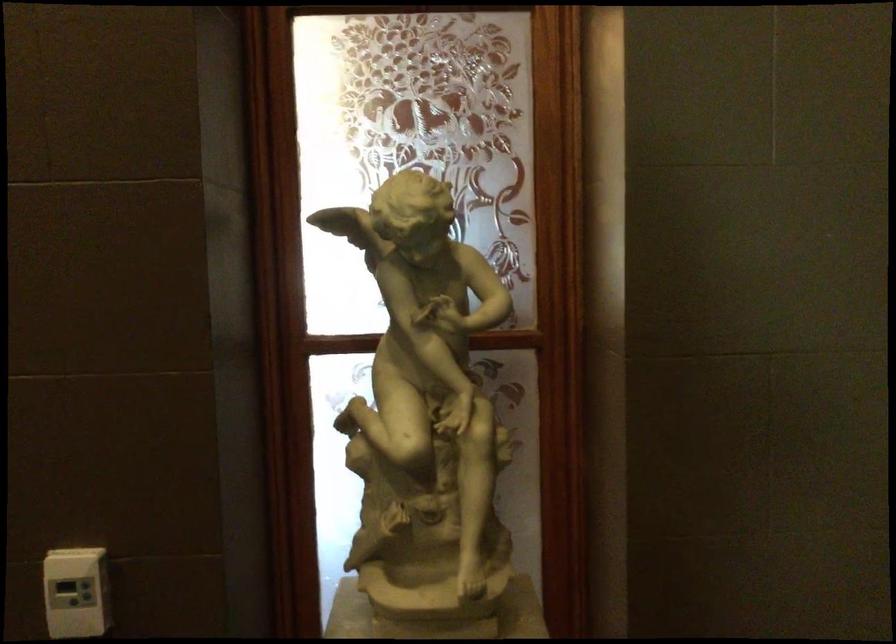
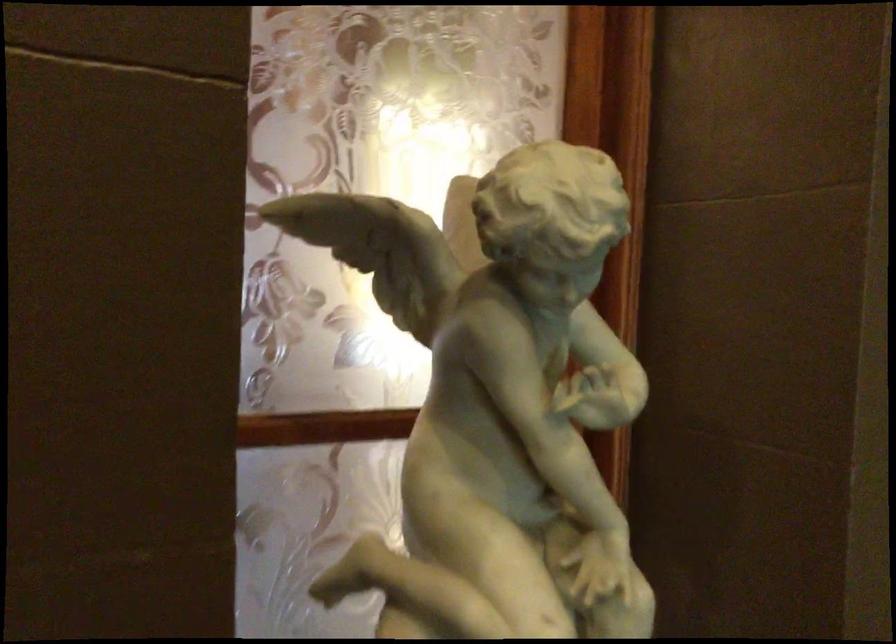
Which direction would the cameraman need to move to produce the second image?

The movement direction of the cameraman is left, forward.